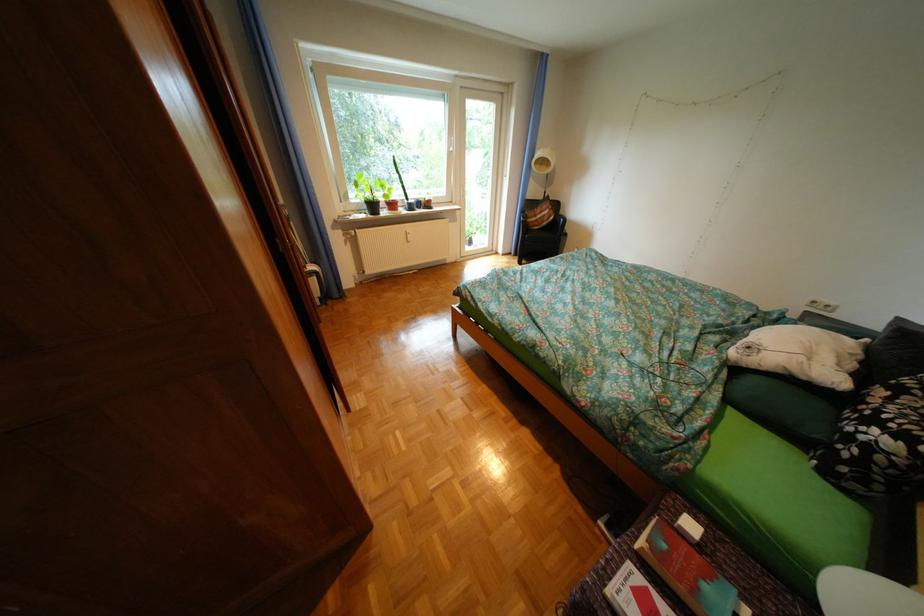
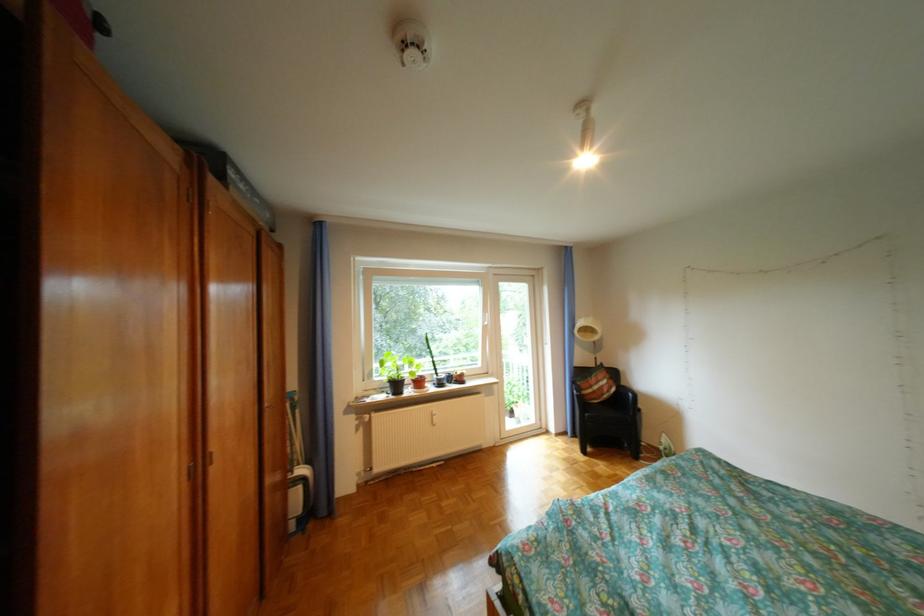
Where in the second image is the point corresponding to the point at 327,268 from the first image?

(317, 471)